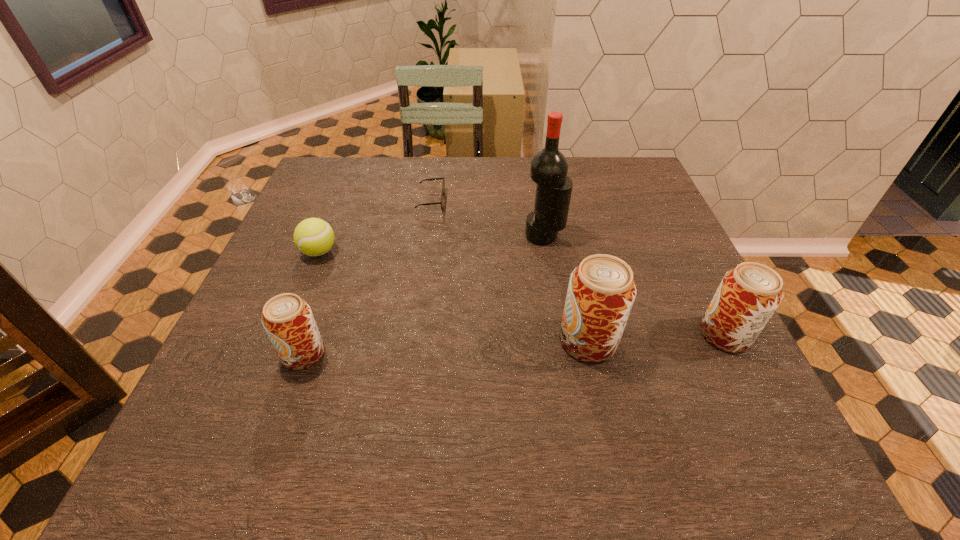
The width and height of the screenshot is (960, 540). In order to click on free space between the second beer can from left to right and the farthest object in this screenshot , I will do `click(510, 271)`.

Identify the location of vacant space in between the tallest object and the sunglasses. (488, 218).

This screenshot has height=540, width=960. What are the coordinates of `vacant area between the rightmost object and the second shortest object` in the screenshot? It's located at (522, 293).

Locate an element on the screen. The image size is (960, 540). vacant point located between the second beer can from right to left and the leftmost beer can is located at coordinates (445, 347).

The width and height of the screenshot is (960, 540). In order to click on vacant space that's between the second shortest object and the rightmost beer can in this screenshot , I will do `click(522, 293)`.

At what (x,y) coordinates should I click in order to perform the action: click on object that ranks as the third closest to the fourth tallest object. Please return your answer as a coordinate pair (x, y). The width and height of the screenshot is (960, 540). Looking at the image, I should click on (601, 292).

Where is `object identified as the closest to the wine bottle`? The image size is (960, 540). object identified as the closest to the wine bottle is located at coordinates (443, 185).

This screenshot has width=960, height=540. In order to click on beer can that stands as the second closest to the rightmost beer can in this screenshot , I will do `click(287, 319)`.

Locate an element on the screen. This screenshot has height=540, width=960. the third closest beer can to the tennis ball is located at coordinates (748, 295).

Image resolution: width=960 pixels, height=540 pixels. In order to click on vacant area in the image that satisfies the following two spatial constraints: 1. on the front-facing side of the tallest object; 2. on the right side of the shortest object in this screenshot , I will do `click(426, 235)`.